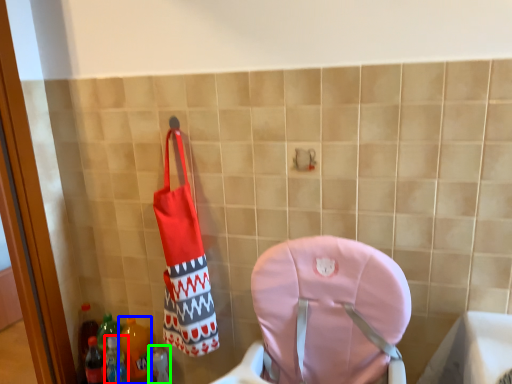
Question: Considering the real-world distances, which object is farthest from bottle (highlighted by a red box)? bottle (highlighted by a blue box) or bottle (highlighted by a green box)?

Choices:
 (A) bottle
 (B) bottle

Answer: (B)